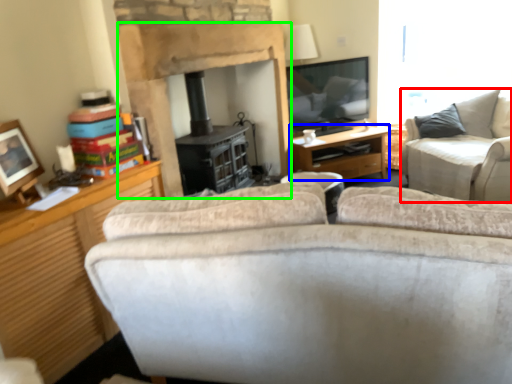
Question: Estimate the real-world distances between objects in this image. Which object is farther from studio couch (highlighted by a red box), desk (highlighted by a blue box) or fireplace (highlighted by a green box)?

Choices:
 (A) desk
 (B) fireplace

Answer: (B)